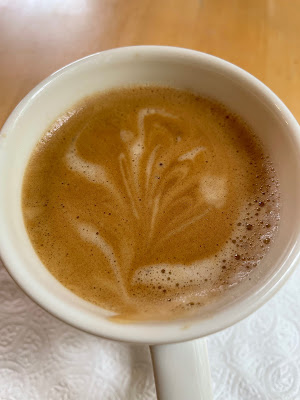
Identify the location of light glare. (65, 7).